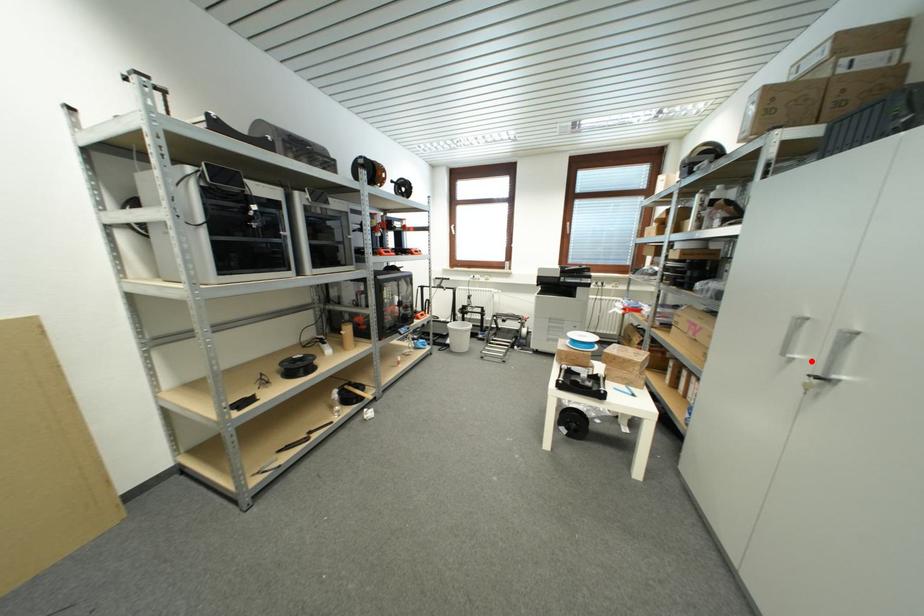
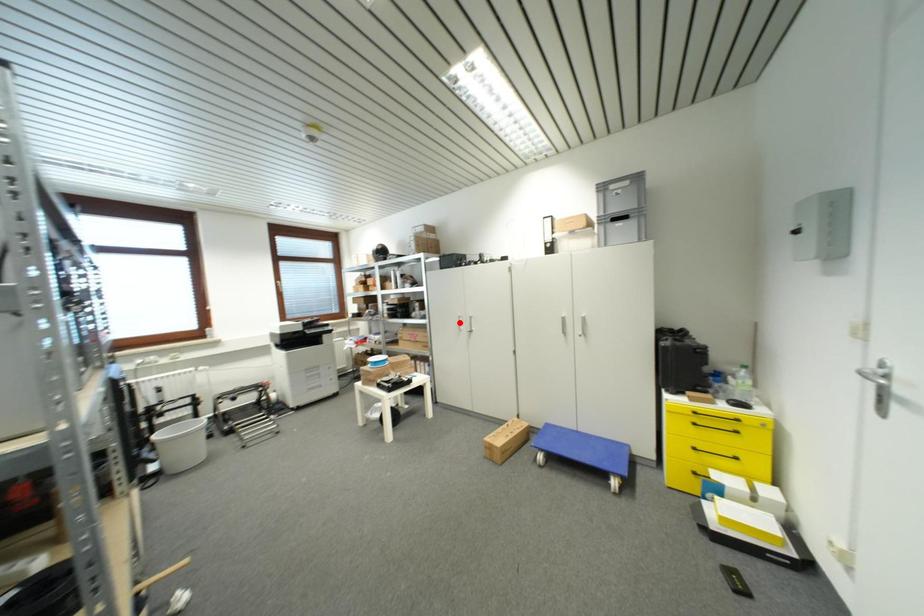
I am providing you with two images of the same scene from different viewpoints. A red point is marked on the first image and another point is marked on the second image. Is the red point in image1 aligned with the point shown in image2?

No